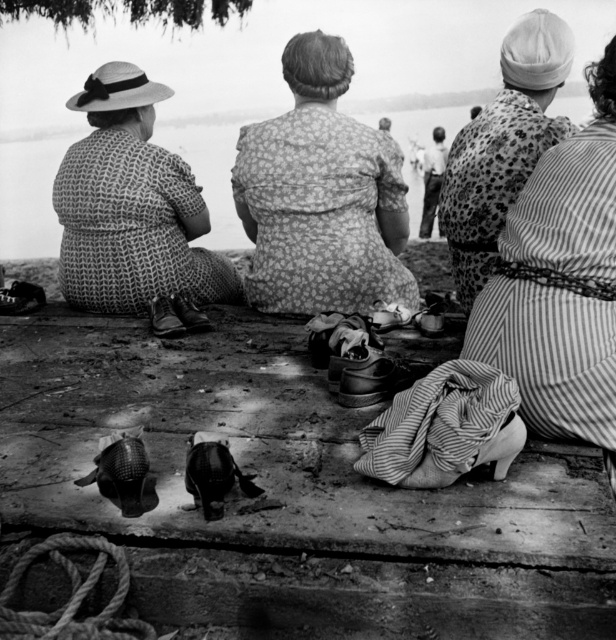
Which is in front, point (78, 304) or point (530, 109)?

Positioned in front is point (530, 109).

Does point (179, 244) lie in front of point (487, 237)?

No, (179, 244) is behind (487, 237).

Who is more distant from viewer, (147, 269) or (482, 176)?

Positioned behind is point (147, 269).

Where is `woven fabric hat at left`? woven fabric hat at left is located at coordinates click(132, 209).

Can you confirm if floral fabric dress at center is positioned above smooth skin man at center?

No, floral fabric dress at center is not above smooth skin man at center.

Describe the element at coordinates (320, 196) in the screenshot. I see `floral fabric dress at center` at that location.

The image size is (616, 640). Identify the location of floral fabric dress at center. (320, 196).

From the picture: Which is more to the right, floral fabric dress at center or printed fabric dress at center?

printed fabric dress at center is more to the right.

Which is behind, point (373, 209) or point (472, 177)?

Positioned behind is point (373, 209).

Where is `floral fabric dress at center`? This screenshot has width=616, height=640. floral fabric dress at center is located at coordinates (320, 196).